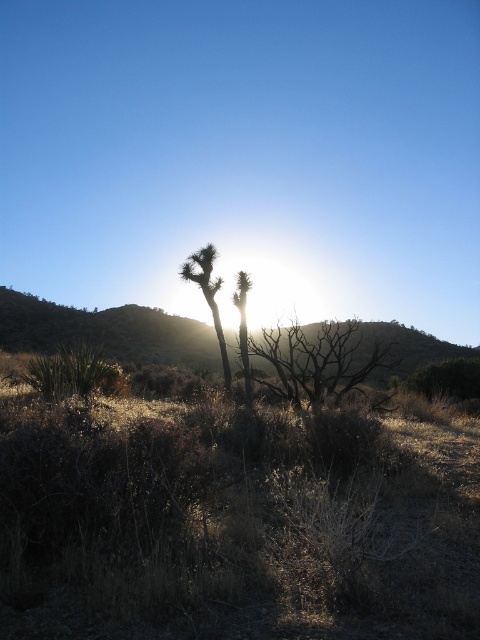
Question: Where is brown/dry wood at center located in relation to green leafy tree at center in the image?

Choices:
 (A) left
 (B) right

Answer: (B)

Question: Which object is closer to the camera taking this photo?

Choices:
 (A) green spiky cactus at center
 (B) brown/dry wood at center

Answer: (B)

Question: Does green leafy tree at center appear on the right side of green spiky cactus at center?

Choices:
 (A) no
 (B) yes

Answer: (A)

Question: Which of the following is the farthest from the observer?

Choices:
 (A) brown/dry wood at center
 (B) green leafy tree at center
 (C) green spiky cactus at center

Answer: (C)

Question: Can you confirm if brown/dry wood at center is smaller than green spiky cactus at center?

Choices:
 (A) no
 (B) yes

Answer: (A)

Question: Which point is farther to the camera?

Choices:
 (A) green leafy tree at center
 (B) brown/dry wood at center

Answer: (A)